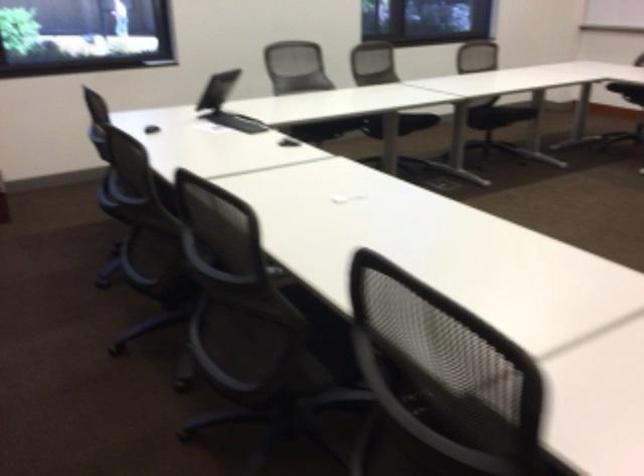
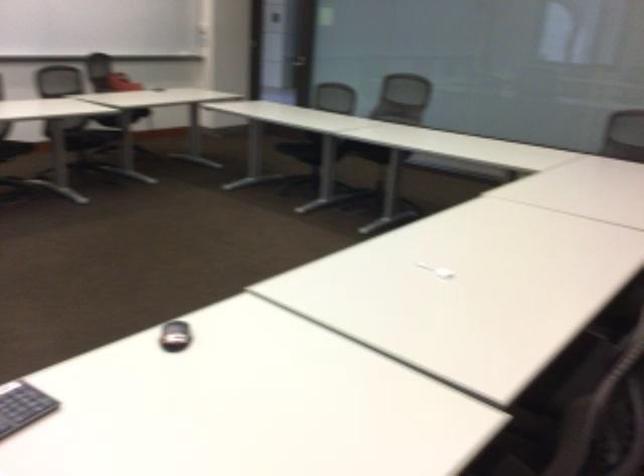
Question: Which direction would the cameraman need to move to produce the second image? Reply with the corresponding letter.

Choices:
 (A) Left
 (B) Right
 (C) Forward
 (D) Backward

Answer: (D)